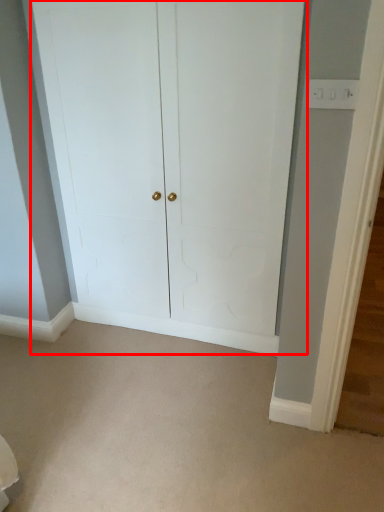
Question: From the image's perspective, considering the relative positions of door (annotated by the red box) and plain in the image provided, where is door (annotated by the red box) located with respect to the staircase?

Choices:
 (A) below
 (B) above

Answer: (B)